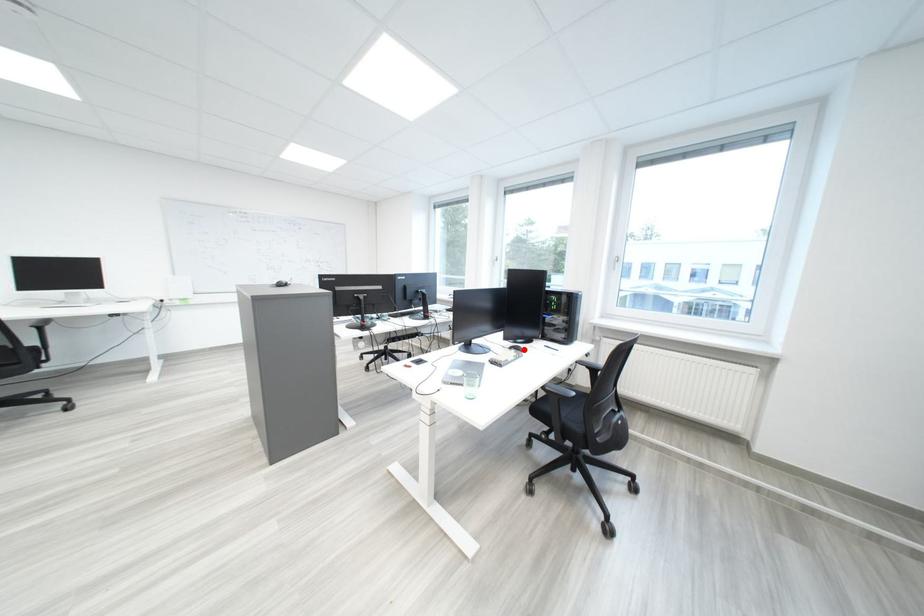
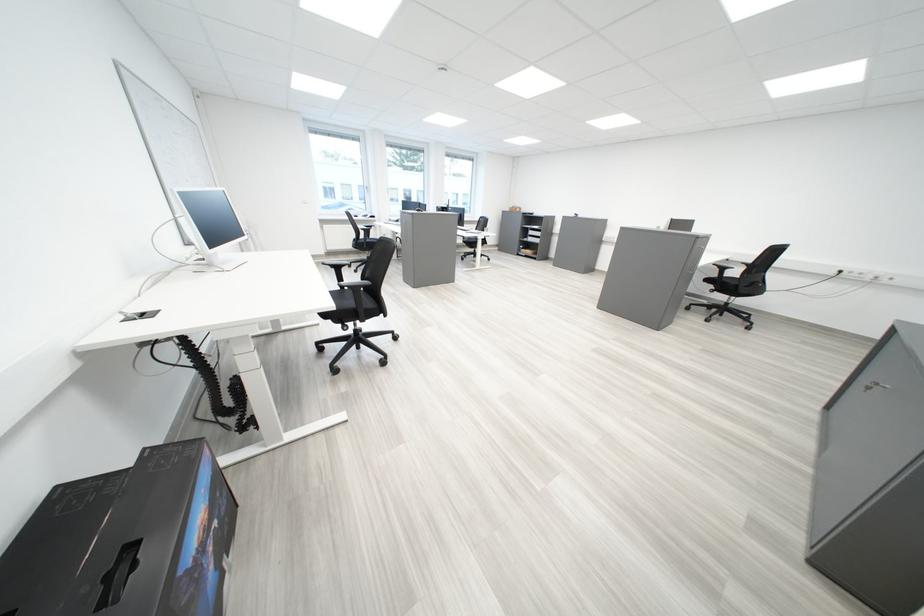
Question: I am providing you with two images of the same scene from different viewpoints. A red point is marked on the first image. Can you still see the location of the red point in image 2?

Choices:
 (A) Yes
 (B) No

Answer: (B)